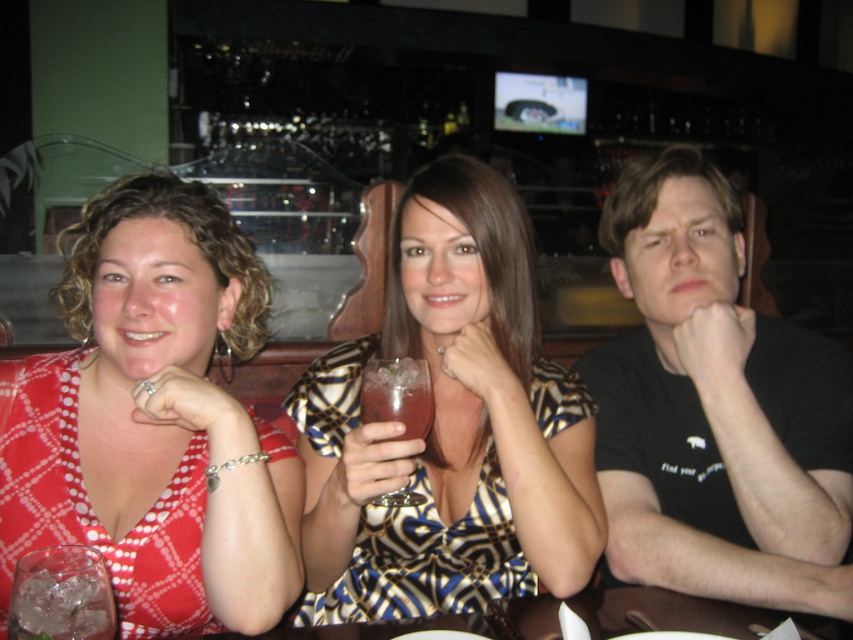
Question: Where is printed silk dress at center located in relation to black cotton t-shirt at center in the image?

Choices:
 (A) left
 (B) right

Answer: (A)

Question: Which object is closer to the camera taking this photo?

Choices:
 (A) clear glass at center
 (B) polka dot fabric dress at left

Answer: (B)

Question: Which point is farther to the camera?

Choices:
 (A) (653, 170)
 (B) (563, 436)
 (C) (88, 560)

Answer: (A)

Question: Is polka dot fabric dress at left to the right of printed silk dress at center from the viewer's perspective?

Choices:
 (A) no
 (B) yes

Answer: (A)

Question: Is black cotton t-shirt at center further to camera compared to clear glass ice at lower left?

Choices:
 (A) yes
 (B) no

Answer: (A)

Question: Which object is the closest to the polka dot fabric dress at left?

Choices:
 (A) printed silk dress at center
 (B) clear glass ice at lower left

Answer: (A)